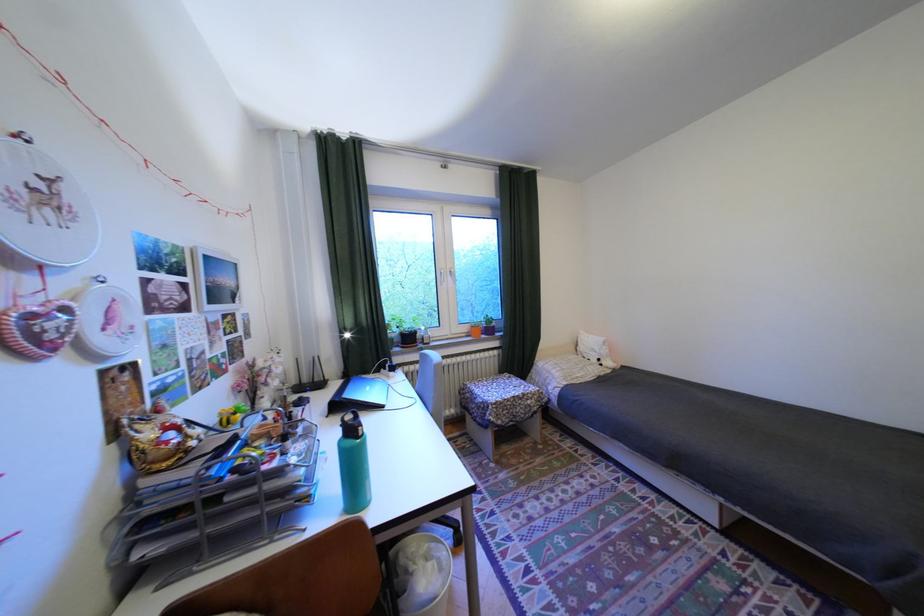
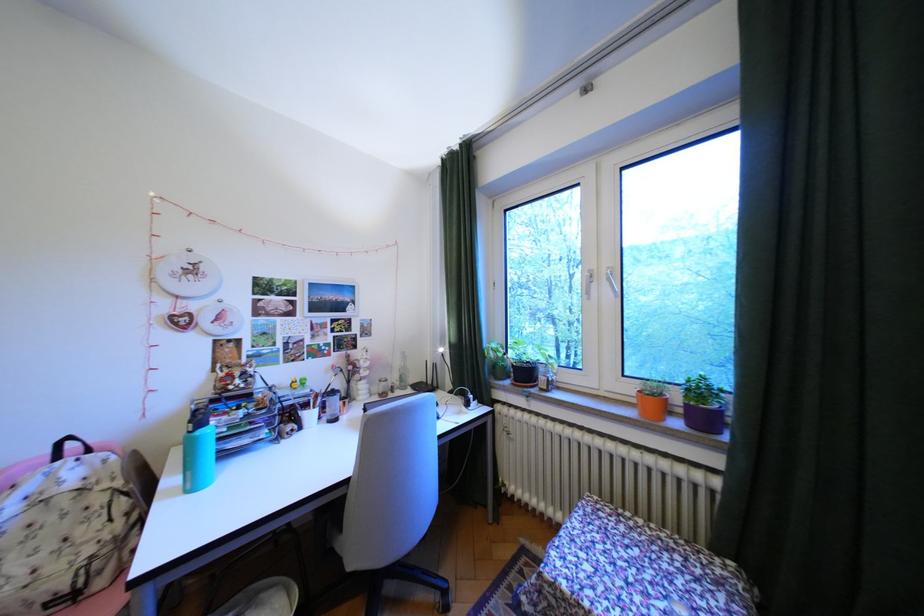
In the second image, find the point that corresponds to point 478,329 in the first image.

(641, 390)